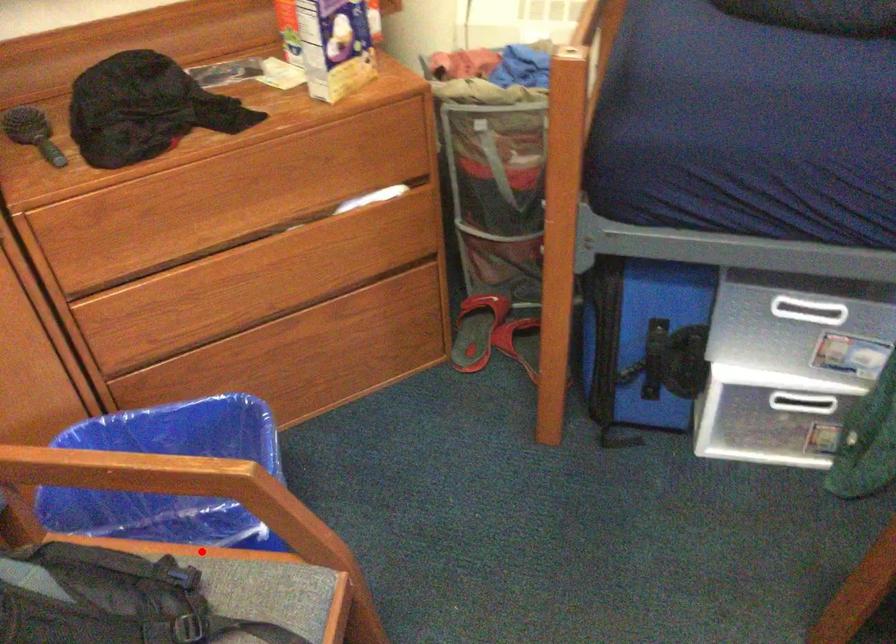
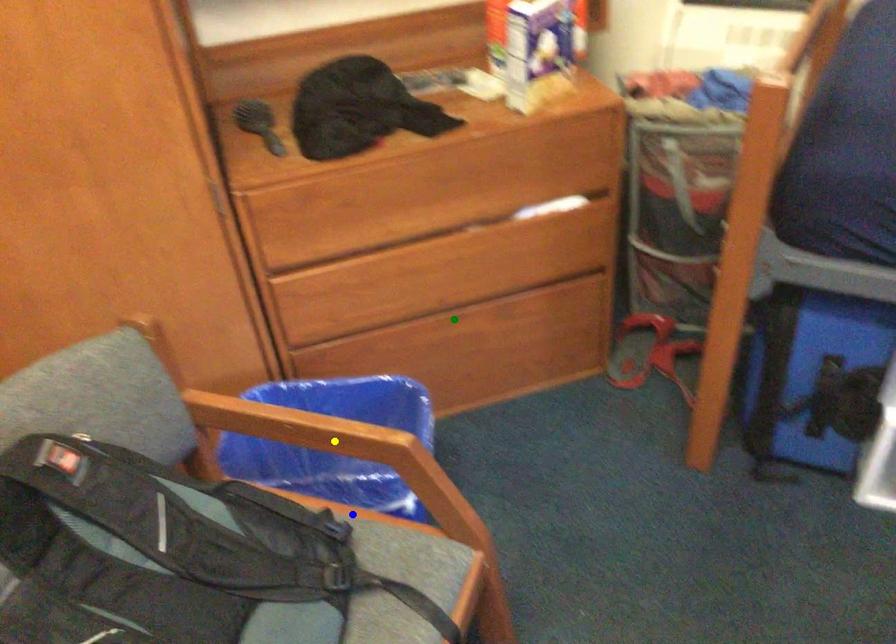
Question: I am providing you with two images of the same scene from different viewpoints. A red point is marked on the first image. You are given multiple points on the second image. Which point in image 2 is actually the same real-world point as the red point in image 1?

Choices:
 (A) yellow point
 (B) blue point
 (C) green point

Answer: (B)